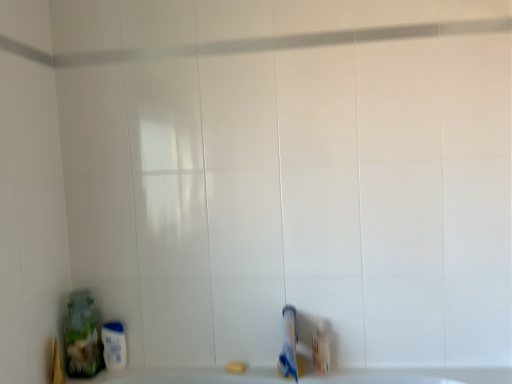
Question: Considering the positions of point (321, 372) and point (240, 369), is point (321, 372) closer or farther from the camera than point (240, 369)?

Choices:
 (A) closer
 (B) farther

Answer: (A)

Question: From the image's perspective, is translucent plastic bottle at lower right located above or below yellow matte bar of soap at lower center?

Choices:
 (A) below
 (B) above

Answer: (B)

Question: Estimate the real-world distances between objects in this image. Which object is farther from the translucent plastic bottle at lower right?

Choices:
 (A) blue matte toothpaste at lower center
 (B) yellow matte bar of soap at lower center

Answer: (B)

Question: Based on their relative distances, which object is nearer to the yellow matte bar of soap at lower center?

Choices:
 (A) translucent plastic bottle at lower right
 (B) blue matte toothpaste at lower center

Answer: (B)